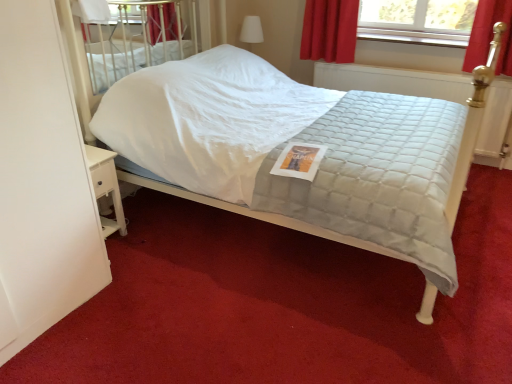
Question: Considering the positions of point 238,89 and point 103,157, is point 238,89 closer or farther from the camera than point 103,157?

Choices:
 (A) farther
 (B) closer

Answer: (A)

Question: Is white quilted fabric bed at center spatially inside white wood nightstand at lower left, or outside of it?

Choices:
 (A) outside
 (B) inside

Answer: (A)

Question: Which of these objects is positioned farthest from the white matte screen door at left?

Choices:
 (A) white wood nightstand at lower left
 (B) white quilted fabric bed at center

Answer: (B)

Question: Which is nearer to the white quilted fabric bed at center?

Choices:
 (A) white matte screen door at left
 (B) white wood nightstand at lower left

Answer: (B)